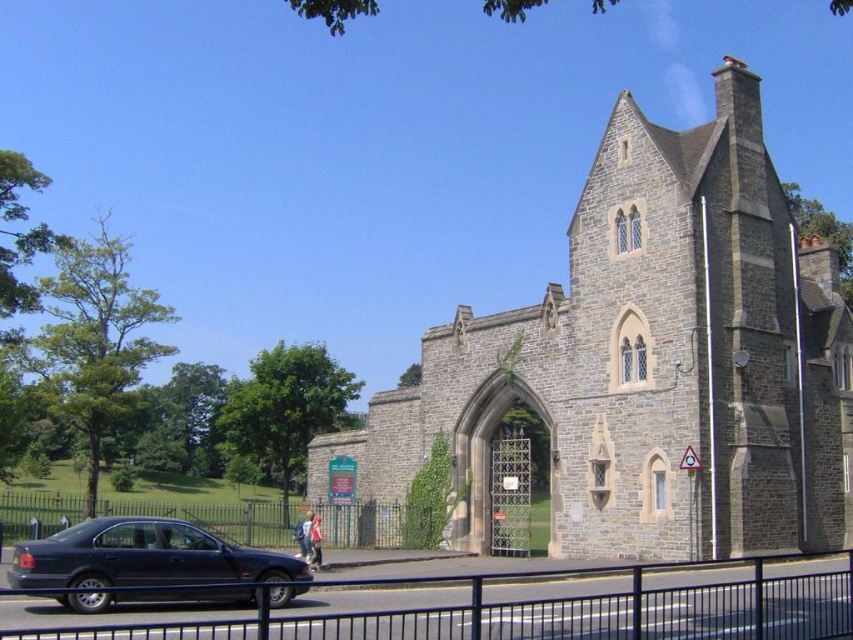
Question: Is gray stone church at center wider than green metal fence at lower center?

Choices:
 (A) no
 (B) yes

Answer: (A)

Question: Does matte black car at lower left have a larger size compared to green metal fence at lower center?

Choices:
 (A) yes
 (B) no

Answer: (B)

Question: Which object is the closest to the gray stone church at center?

Choices:
 (A) green metal fence at lower center
 (B) matte black car at lower left

Answer: (A)

Question: Can you confirm if metallic blue fence at lower center is thinner than matte black car at lower left?

Choices:
 (A) no
 (B) yes

Answer: (A)

Question: Among these points, which one is farthest from the camera?

Choices:
 (A) (125, 554)
 (B) (341, 547)

Answer: (B)

Question: Which object is closer to the camera taking this photo?

Choices:
 (A) matte black car at lower left
 (B) gray stone church at center
 (C) metallic blue fence at lower center

Answer: (C)